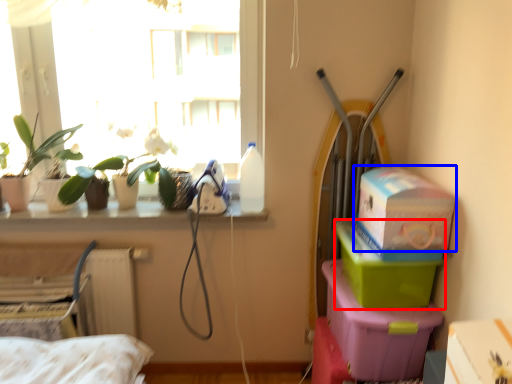
Question: Among these objects, which one is nearest to the camera, box (highlighted by a red box) or box (highlighted by a blue box)?

Choices:
 (A) box
 (B) box

Answer: (B)